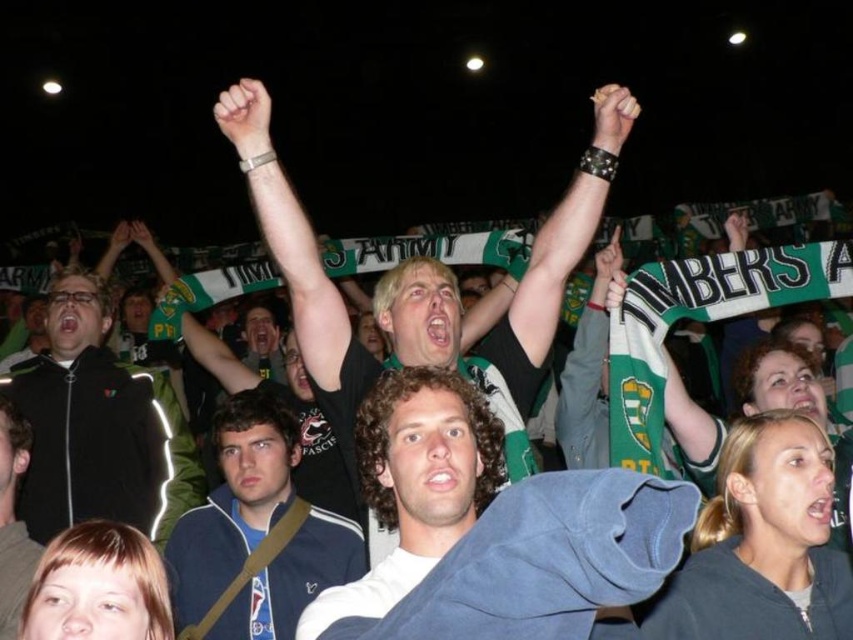
Question: Which point is farther to the camera?

Choices:
 (A) (206, 541)
 (B) (71, 305)
 (C) (314, 349)

Answer: (B)

Question: Which point is farther to the camera?

Choices:
 (A) (102, 378)
 (B) (322, 307)

Answer: (A)

Question: Among these objects, which one is farthest from the camera?

Choices:
 (A) black t-shirt at center
 (B) black matte jacket at left
 (C) blue fabric jacket at center
 (D) curly-haired man at center

Answer: (B)

Question: Does black t-shirt at center appear over dark blue jacket at lower left?

Choices:
 (A) yes
 (B) no

Answer: (A)

Question: Is black t-shirt at center bigger than black matte jacket at left?

Choices:
 (A) no
 (B) yes

Answer: (A)

Question: Where is black t-shirt at center located in relation to dark blue jacket at lower left in the image?

Choices:
 (A) below
 (B) above

Answer: (B)